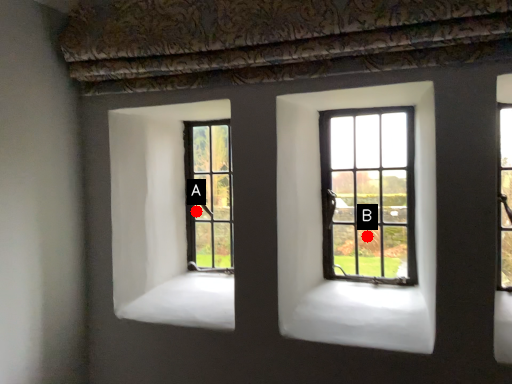
Question: Two points are circled on the image, labeled by A and B beside each circle. Which point appears closest to the camera in this image?

Choices:
 (A) A is closer
 (B) B is closer

Answer: (B)